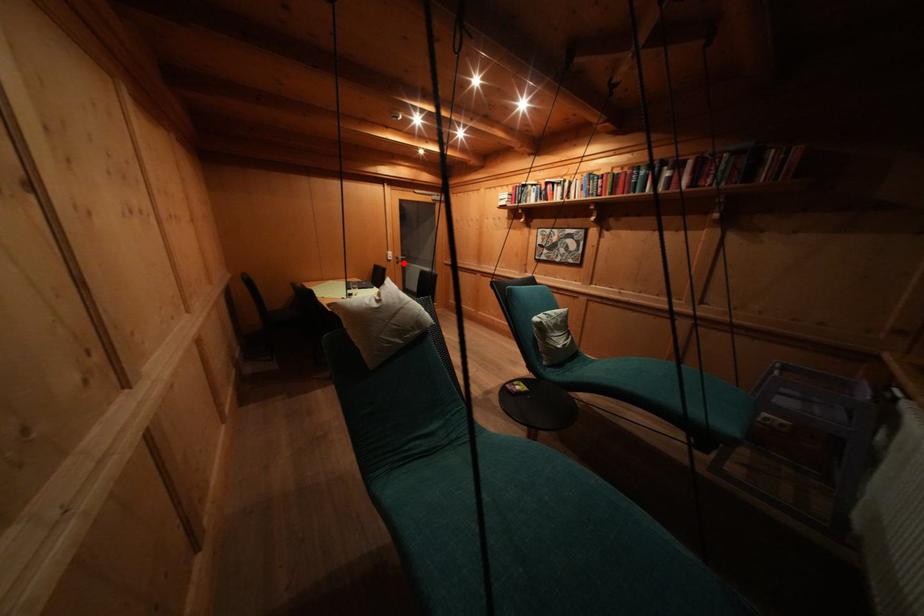
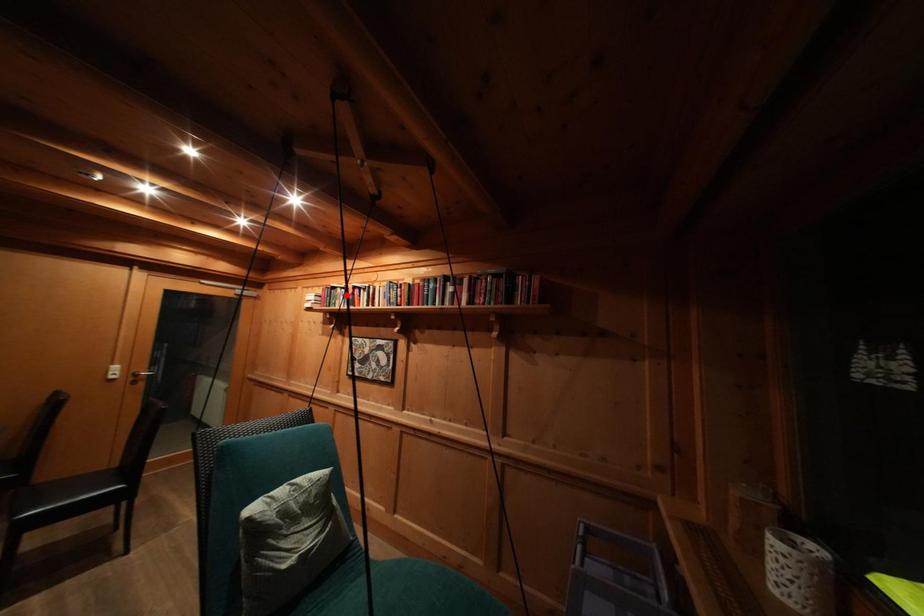
I am providing you with two images of the same scene from different viewpoints. A red point is marked on the first image and another point is marked on the second image. Does the point marked in image1 correspond to the same location as the one in image2?

No